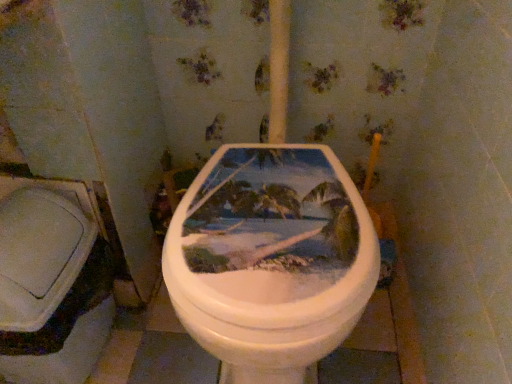
The width and height of the screenshot is (512, 384). Identify the location of empty space that is ontop of white plastic lid at lower left (from a real-world perspective). (17, 208).